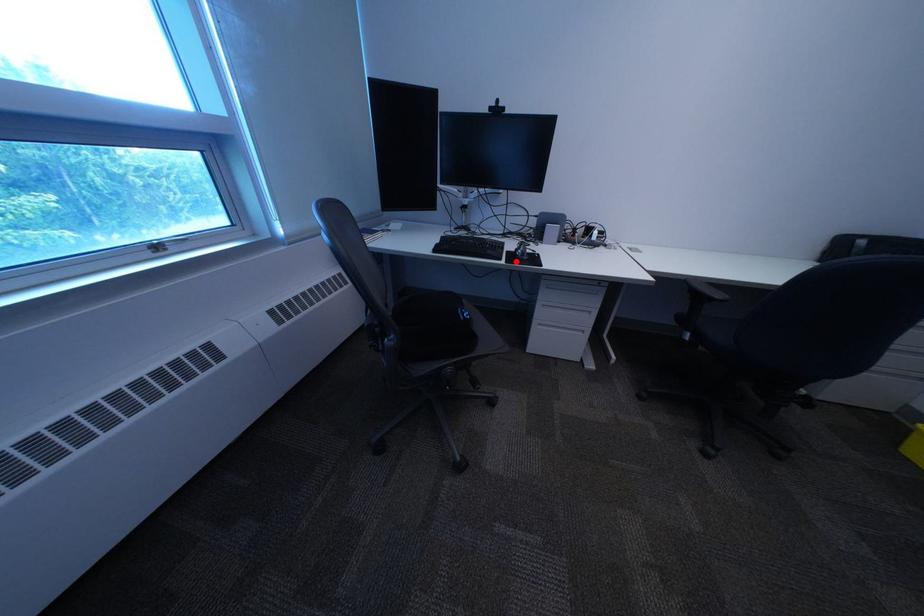
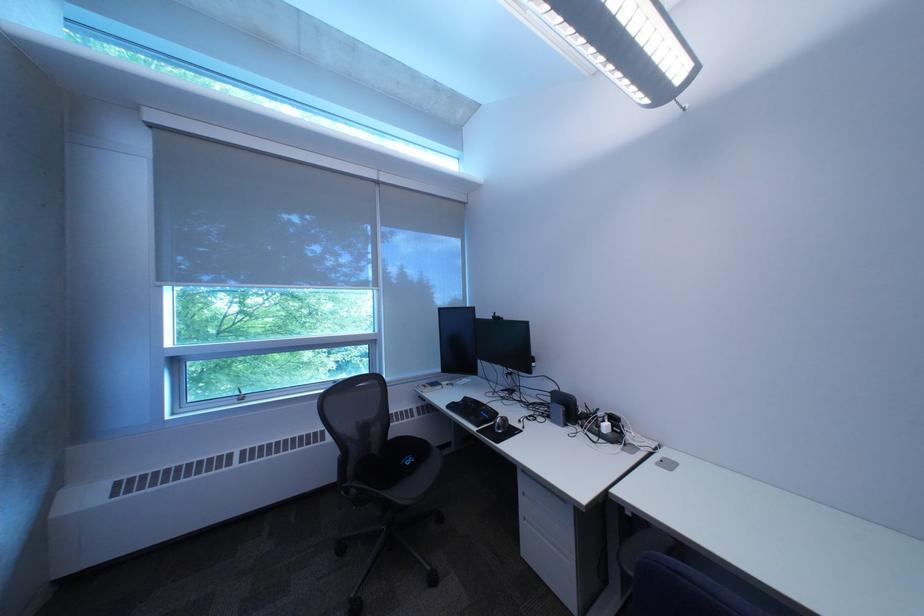
In the second image, find the point that corresponds to the highlighted location in the first image.

(492, 429)